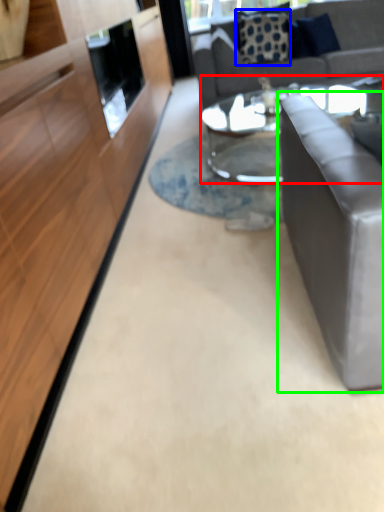
Question: Based on their relative distances, which object is nearer to coffee table (highlighted by a red box)? Choose from pillow (highlighted by a blue box) and studio couch (highlighted by a green box).

Choices:
 (A) pillow
 (B) studio couch

Answer: (A)